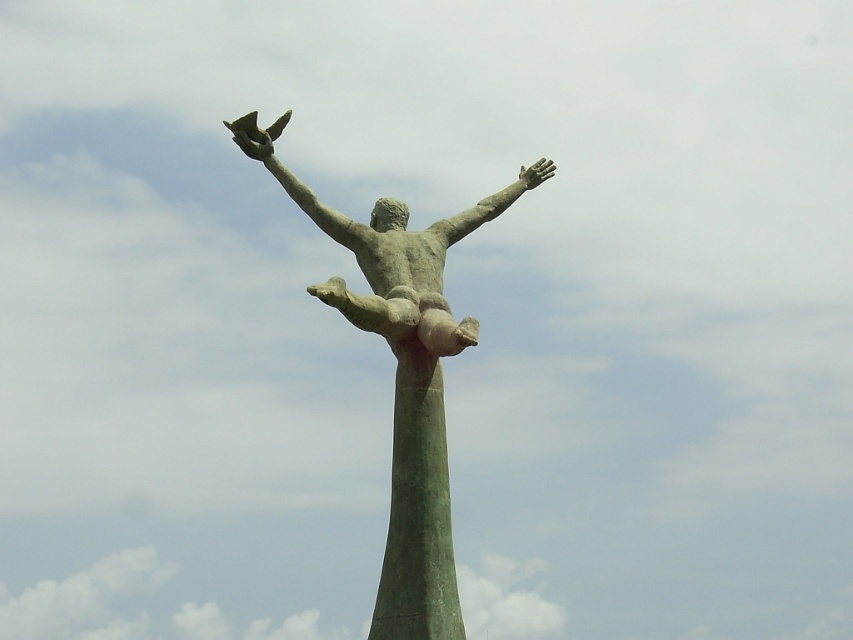
Which of these two, green patina pole at center or green patina statue arm at upper center, stands shorter?

green patina statue arm at upper center

Is green patina pole at center wider than green patina statue arm at upper center?

No, green patina pole at center is not wider than green patina statue arm at upper center.

Does point (444, 548) lie behind point (486, 198)?

No, it is not.

You are a GUI agent. You are given a task and a screenshot of the screen. Output one action in this format:
    pyautogui.click(x=<x>, y=<y>)
    Task: Click on the green patina pole at center
    The width and height of the screenshot is (853, 640).
    Given the screenshot: What is the action you would take?
    pyautogui.click(x=416, y=513)

Between point (440, 424) and point (486, 196), which one is positioned behind?

The point (486, 196) is behind.

Is point (434, 384) behind point (521, 180)?

That is False.

Image resolution: width=853 pixels, height=640 pixels. Find the location of `green patina statue at center`. green patina statue at center is located at coordinates (403, 376).

Which is below, green patina statue at center or bronze statue at center?

Positioned lower is green patina statue at center.

What do you see at coordinates (403, 376) in the screenshot? Image resolution: width=853 pixels, height=640 pixels. I see `green patina statue at center` at bounding box center [403, 376].

Locate an element on the screen. The image size is (853, 640). green patina statue at center is located at coordinates (403, 376).

The height and width of the screenshot is (640, 853). In order to click on green patina statue at center in this screenshot , I will do `click(403, 376)`.